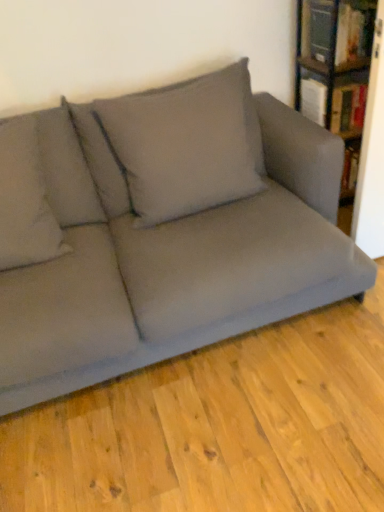
Question: In terms of size, does hardcover book at upper right, which is the 2th book in bottom-to-top order, appear bigger or smaller than gray fabric pillow at upper center, acting as the 1th pillow starting from the right?

Choices:
 (A) big
 (B) small

Answer: (B)

Question: From their relative heights in the image, would you say hardcover book at upper right, which is the 2th book in bottom-to-top order, is taller or shorter than gray fabric pillow at upper center, the 2th pillow in the left-to-right sequence?

Choices:
 (A) tall
 (B) short

Answer: (B)

Question: Which of these objects is positioned closest to the gray fabric pillow at upper left, the 1th pillow positioned from the left?

Choices:
 (A) matte gray couch at center
 (B) gray fabric pillow at upper center, acting as the 1th pillow starting from the right
 (C) hardcover book at upper right, which is the 2th book in bottom-to-top order
 (D) hardcover book at upper right, placed as the second book when sorted from top to bottom
 (E) wooden bookshelf at upper right

Answer: (B)

Question: Based on their relative distances, which object is farther from the gray fabric pillow at upper left, which appears as the second pillow when viewed from the right?

Choices:
 (A) gray fabric pillow at upper center, the 2th pillow in the left-to-right sequence
 (B) matte gray couch at center
 (C) hardcover book at upper right, placed as the second book when sorted from top to bottom
 (D) hardcover book at upper right, which is the first book from top to bottom
 (E) wooden bookshelf at upper right

Answer: (D)